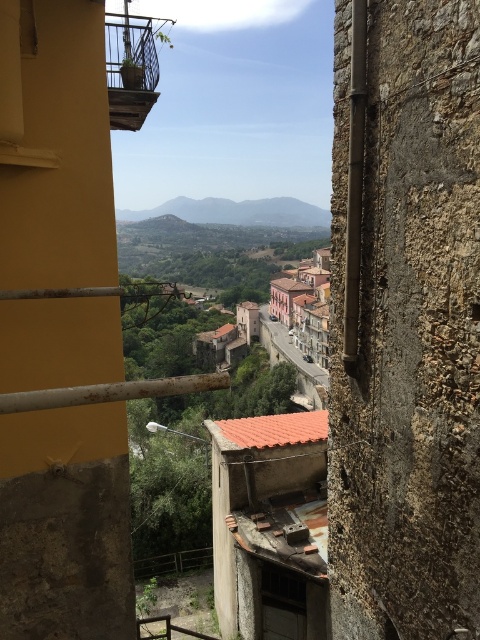
Question: Which point is closer to the camera?

Choices:
 (A) (313, 320)
 (B) (116, 209)
 (C) (302, 371)

Answer: (A)

Question: Is green grassy hillside at center below smooth stone alley at center?

Choices:
 (A) no
 (B) yes

Answer: (A)

Question: Can you confirm if green grassy hillside at center is bigger than smooth stone alley at center?

Choices:
 (A) no
 (B) yes

Answer: (B)

Question: Can you confirm if green grassy hillside at center is positioned to the left of smooth stone alley at center?

Choices:
 (A) no
 (B) yes

Answer: (B)

Question: Considering the real-world distances, which object is farthest from the terracotta tiled building at center?

Choices:
 (A) green grassy hillside at center
 (B) smooth stone alley at center

Answer: (A)

Question: Which point is farther from the camera taking this photo?

Choices:
 (A) (323, 349)
 (B) (284, 209)
 (C) (260, 326)

Answer: (B)